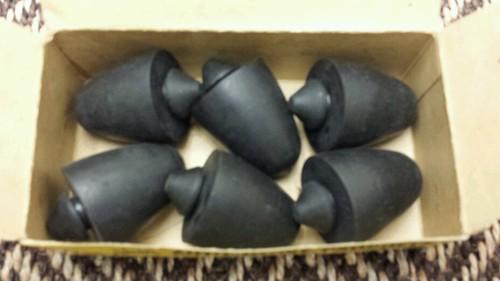
Identify the location of left side of cardboard box. (41, 134).